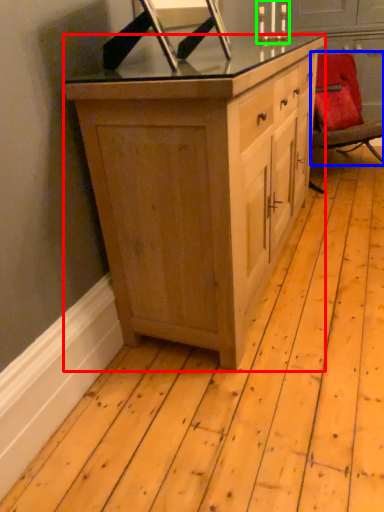
Question: Considering the real-world distances, which object is closest to cabinetry (highlighted by a red box)? chair (highlighted by a blue box) or candle holder (highlighted by a green box).

Choices:
 (A) chair
 (B) candle holder

Answer: (A)